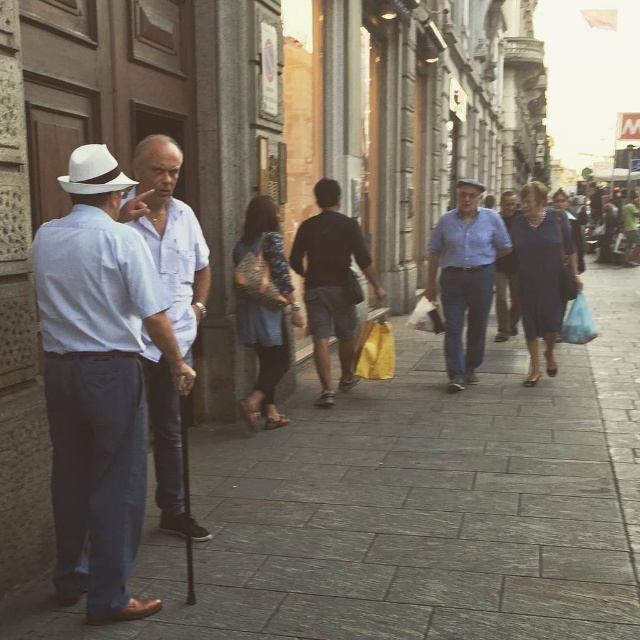
You are a tourist in this European city and want to take a photo of the blue cotton shirt at center and the black felt fedora at center. Since you want both items to be clearly visible in the frame, which one should you focus on first to ensure proper focus?

The blue cotton shirt at center is located below the black felt fedora at center. To ensure both are in focus, you should focus on the black felt fedora at center first, as it is closer to the camera, and the blue cotton shirt at center will naturally fall into the depth of field if focused on the closer object.

You are a street performer who needs to place a 5 foot long pole between the blue cotton shirt at center and the black felt fedora at center. Can the pole fit between them without overlapping either object?

The blue cotton shirt at center and black felt fedora at center are 5.33 feet apart, so the 5 foot long pole can fit between them without overlapping either object since the distance is greater than the pole length.